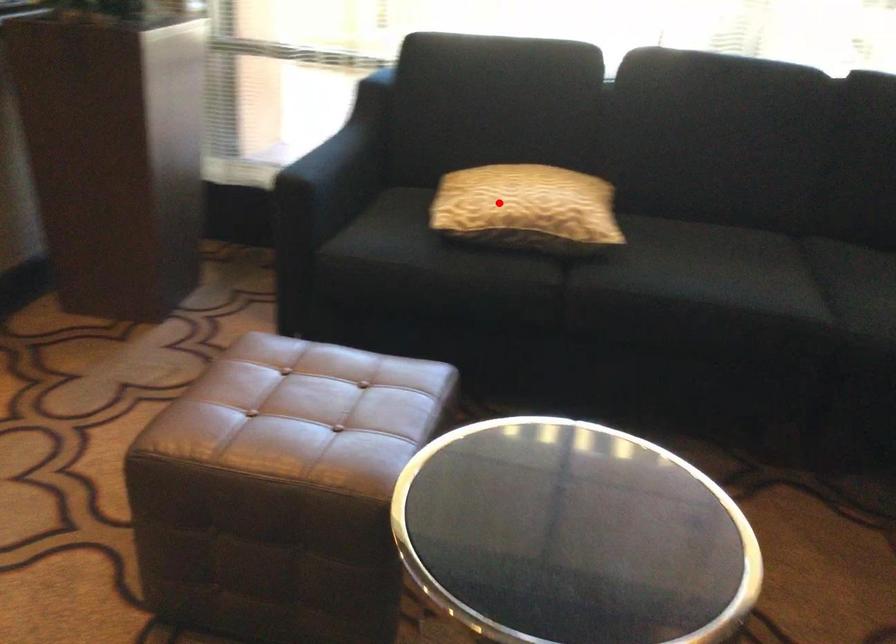
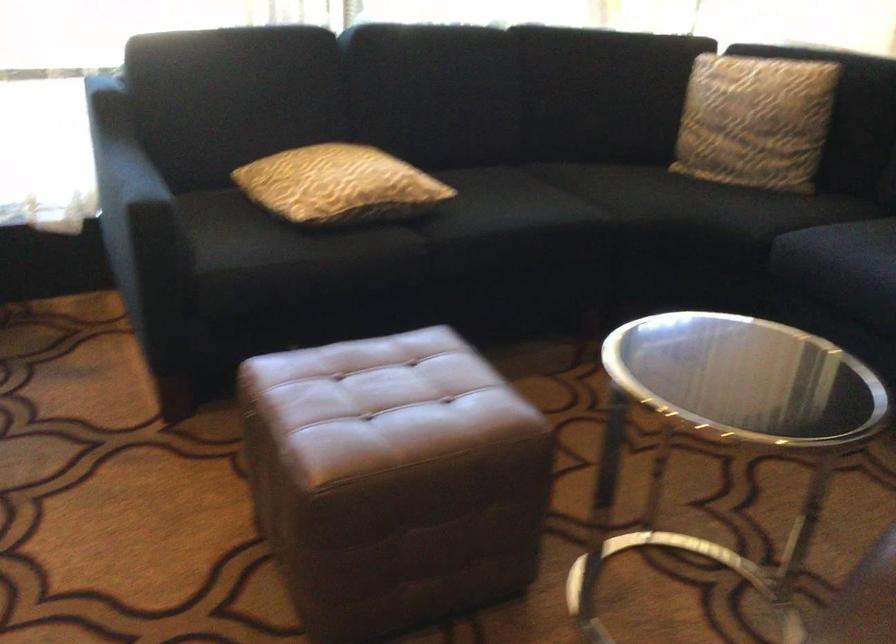
Locate, in the second image, the point that corresponds to the highlighted location in the first image.

(339, 185)